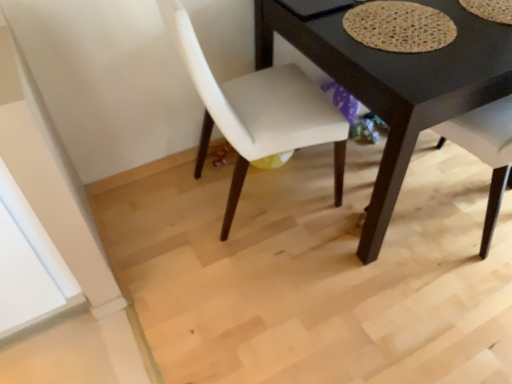
Identify the location of free space in front of white fabric chair at center. (266, 283).